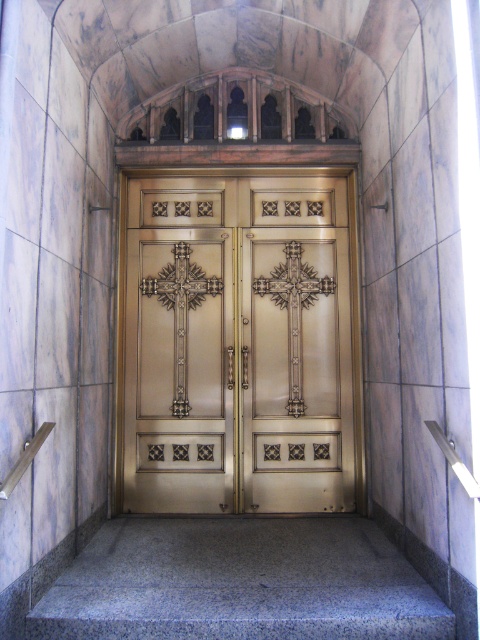
Consider the image. Which is above, gold polished metal doors at center or granite at center?

Positioned higher is gold polished metal doors at center.

Does gold polished metal doors at center have a greater height compared to granite at center?

Yes, gold polished metal doors at center is taller than granite at center.

Does point (213, 211) come in front of point (389, 584)?

No, (213, 211) is behind (389, 584).

Find the location of a particular element. gold polished metal doors at center is located at coordinates (239, 342).